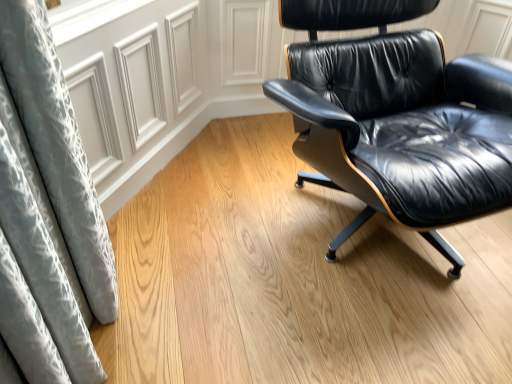
This screenshot has height=384, width=512. Describe the element at coordinates (397, 118) in the screenshot. I see `black leather chair at right` at that location.

I want to click on black leather chair at right, so click(397, 118).

This screenshot has height=384, width=512. I want to click on black leather chair at right, so click(x=397, y=118).